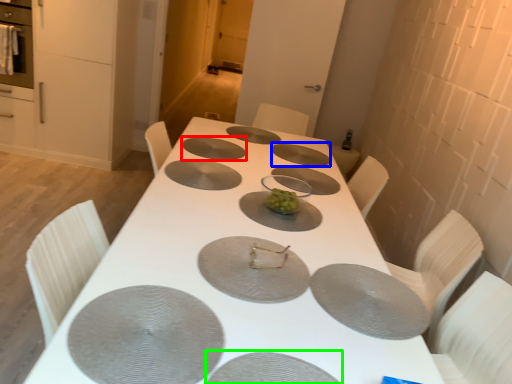
Question: Based on their relative distances, which object is farther from pizza pan (highlighted by a red box)? Choose from pizza pan (highlighted by a blue box) and pizza pan (highlighted by a green box).

Choices:
 (A) pizza pan
 (B) pizza pan

Answer: (B)